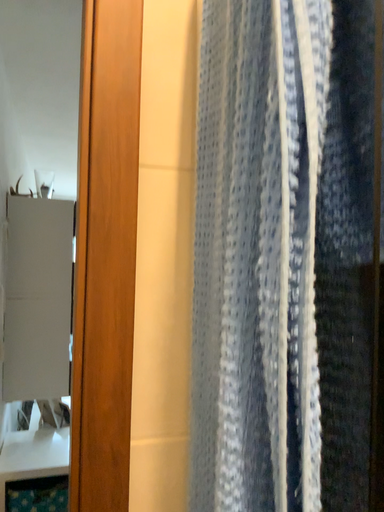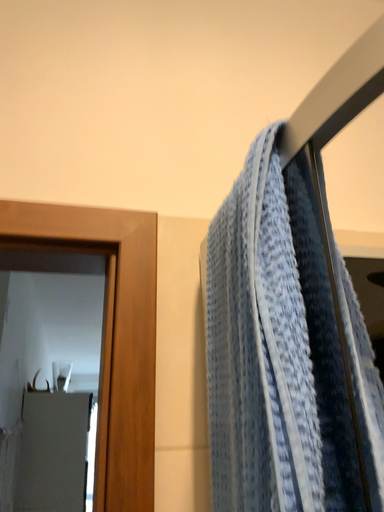
Question: How did the camera likely rotate when shooting the video?

Choices:
 (A) rotated downward
 (B) rotated upward

Answer: (B)